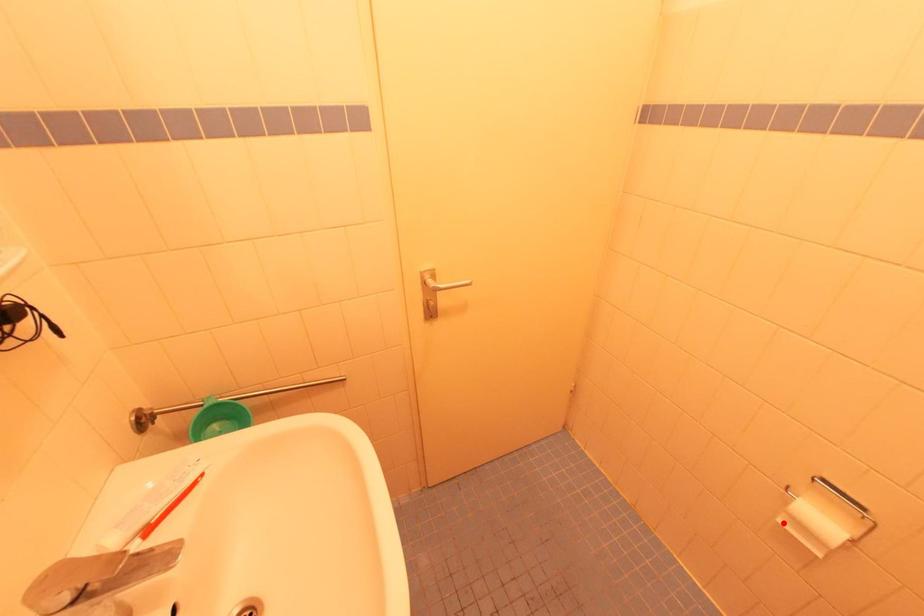
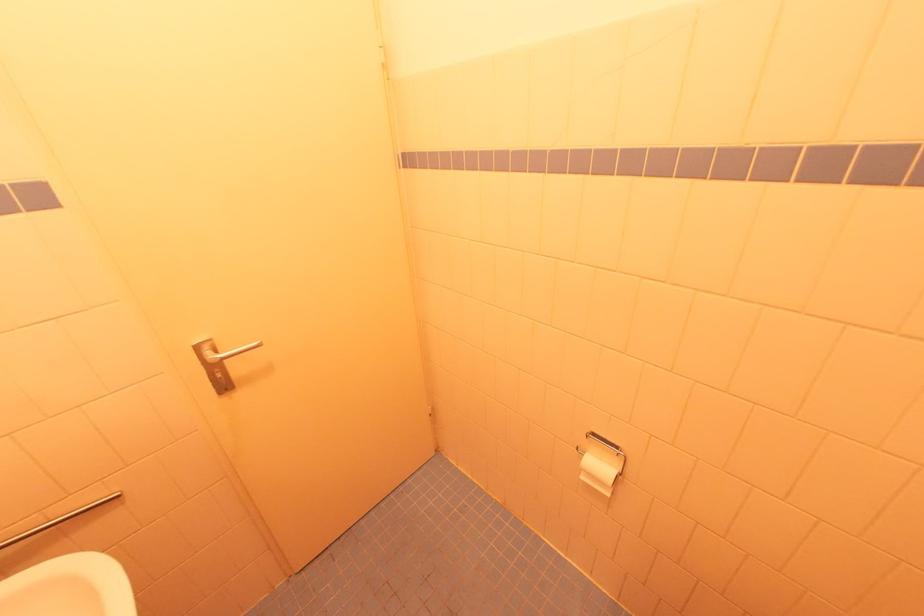
Question: I am providing you with two images of the same scene from different viewpoints. In image1, a red point is highlighted. Considering the same 3D point in image2, which of the following is correct?

Choices:
 (A) It is closer
 (B) It is farther

Answer: (B)